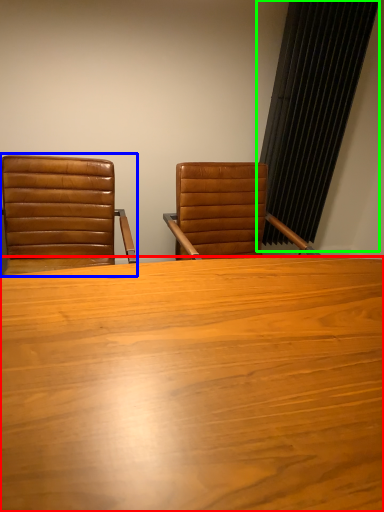
Question: Which is nearer to the table (highlighted by a red box)? chair (highlighted by a blue box) or curtain (highlighted by a green box).

Choices:
 (A) chair
 (B) curtain

Answer: (A)